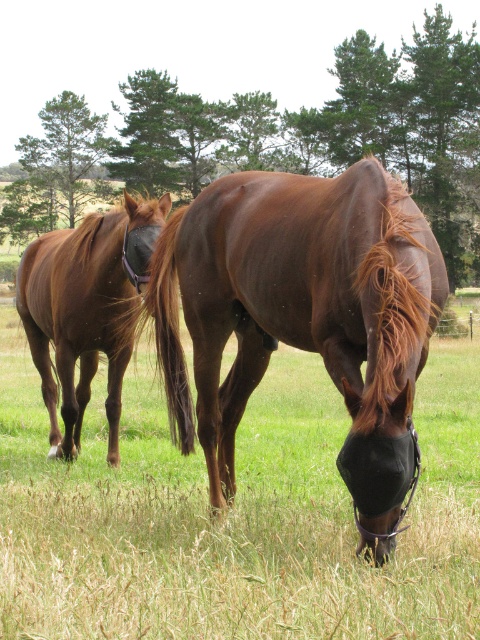
What do you see at coordinates (232, 515) in the screenshot? This screenshot has height=640, width=480. I see `brown leather horse at center` at bounding box center [232, 515].

Does brown leather horse at center have a lesser width compared to brown glossy horse at left?

No.

The image size is (480, 640). What are the coordinates of `brown leather horse at center` in the screenshot? It's located at (x=232, y=515).

Where is `brown leather horse at center`? This screenshot has height=640, width=480. brown leather horse at center is located at coordinates (232, 515).

Between point (309, 621) and point (245, 236), which one is positioned behind?

Positioned behind is point (245, 236).

Which is below, brown leather horse at center or brown glossy horse at center?

brown leather horse at center is below.

Is point (375, 611) positioned in front of point (391, 269)?

Yes, it is.

I want to click on brown leather horse at center, so click(232, 515).

Looking at this image, does brown glossy horse at center appear over brown glossy horse at left?

No, brown glossy horse at center is not above brown glossy horse at left.

Based on the photo, which is more to the right, brown glossy horse at center or brown glossy horse at left?

brown glossy horse at center is more to the right.

Where is `brown glossy horse at center`? This screenshot has height=640, width=480. brown glossy horse at center is located at coordinates (302, 316).